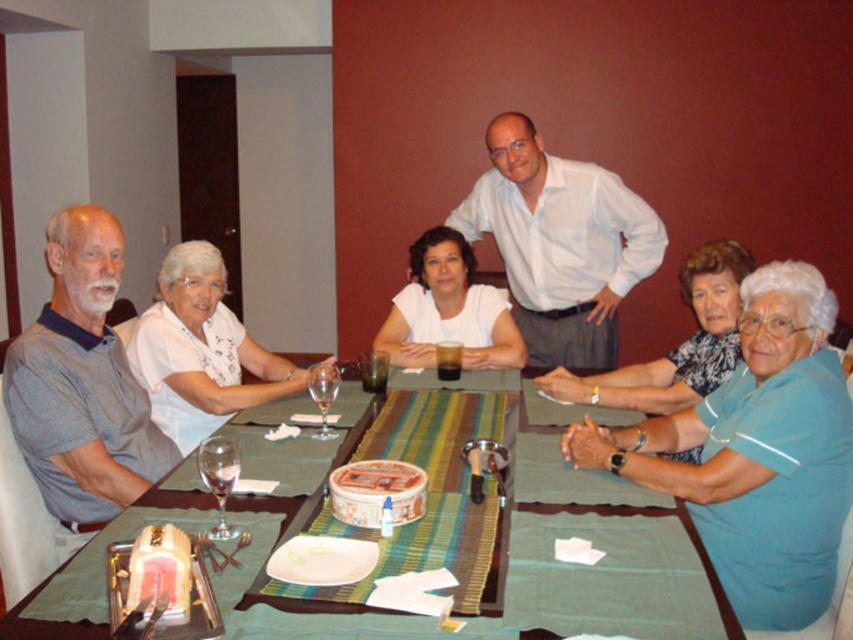
Does smooth plastic container at center have a lesser height compared to clear glass wine glass at table center?

Indeed, smooth plastic container at center has a lesser height compared to clear glass wine glass at table center.

Is point (376, 516) positioned after point (238, 449)?

Yes, it is behind point (238, 449).

The height and width of the screenshot is (640, 853). Identify the location of smooth plastic container at center. (376, 492).

Which is above, matte white shirt at center or pink glossy cake at lower left?

matte white shirt at center is above.

Which is below, matte white shirt at center or pink glossy cake at lower left?

pink glossy cake at lower left is below.

Who is more forward, (425, 316) or (160, 561)?

Positioned in front is point (160, 561).

In order to click on matte white shirt at center in this screenshot , I will do `click(448, 310)`.

Does blue cotton shirt at lower right have a greater height compared to transparent glass wine glass at center?

Correct, blue cotton shirt at lower right is much taller as transparent glass wine glass at center.

Identify the location of blue cotton shirt at lower right. (756, 452).